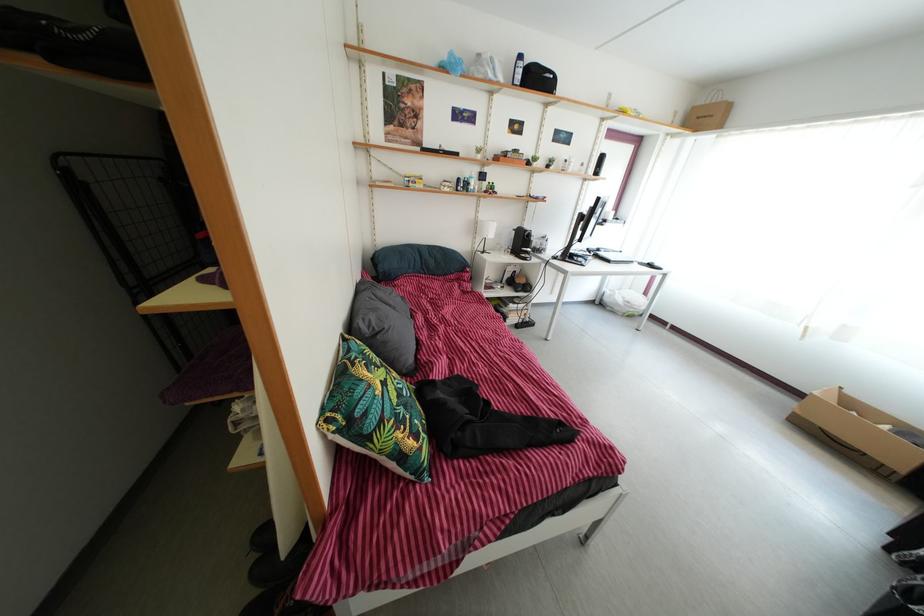
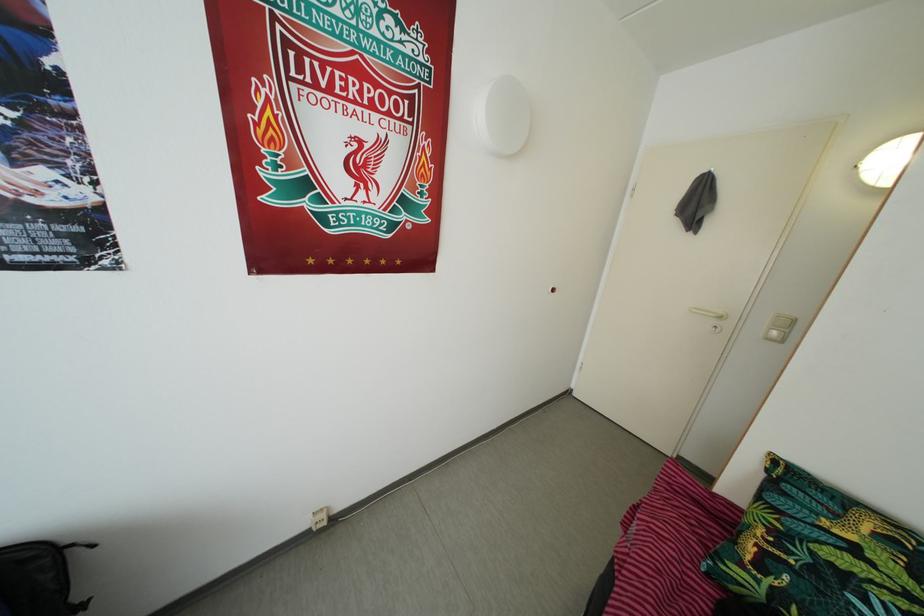
In the second image, find the point that corresponds to the point at 411,416 in the first image.

(820, 578)